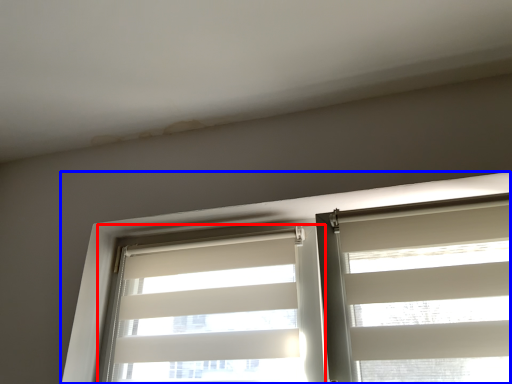
Question: Among these objects, which one is farthest to the camera, window blind (highlighted by a red box) or window (highlighted by a blue box)?

Choices:
 (A) window blind
 (B) window

Answer: (A)